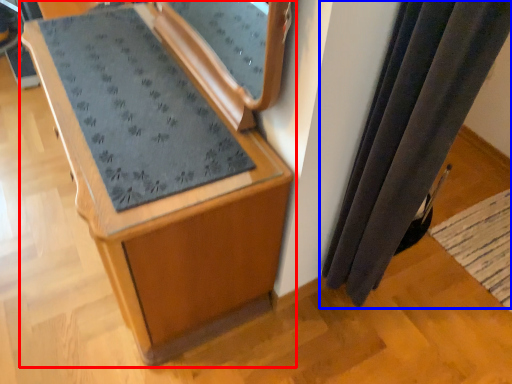
Question: Which point is closer to the camera, furniture (highlighted by a red box) or curtain (highlighted by a blue box)?

Choices:
 (A) furniture
 (B) curtain

Answer: (B)